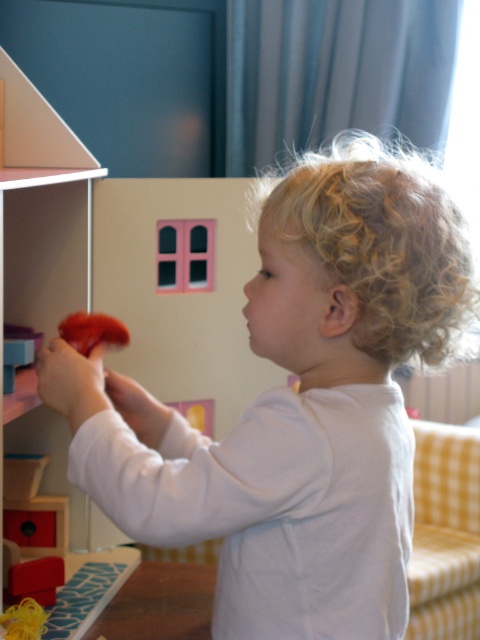
Who is higher up, curly blonde hair at center or matte red toy at left?

Positioned higher is matte red toy at left.

Is curly blonde hair at center further to the viewer compared to matte red toy at left?

No, it is not.

Locate an element on the screen. Image resolution: width=480 pixels, height=640 pixels. curly blonde hair at center is located at coordinates (296, 404).